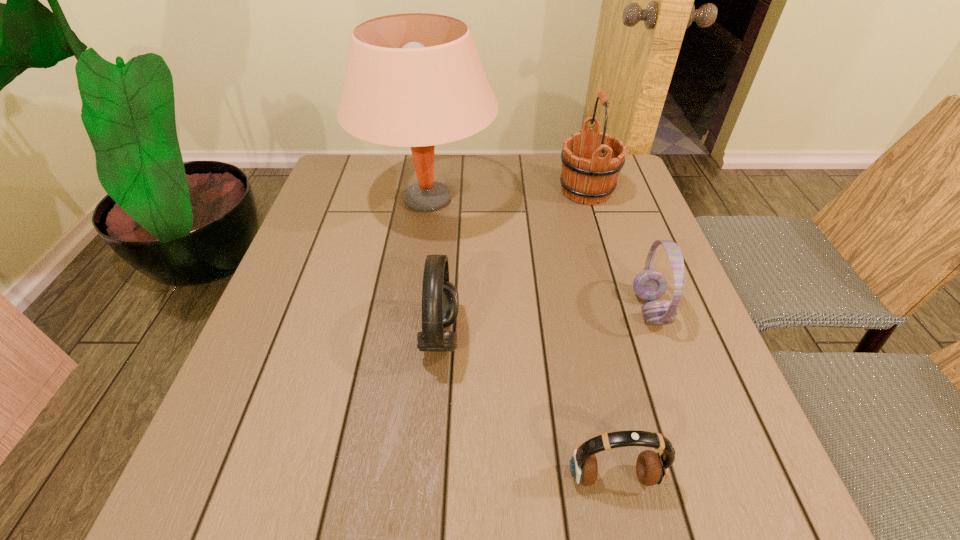
This screenshot has height=540, width=960. I want to click on free space located 0.260m on the headband and ear cups of the rightmost headset, so click(511, 309).

Identify the location of blank space located on the headband and ear cups of the rightmost headset. The width and height of the screenshot is (960, 540). (464, 309).

The height and width of the screenshot is (540, 960). What are the coordinates of `lampshade at the far edge` in the screenshot? It's located at (416, 80).

This screenshot has width=960, height=540. In order to click on wine bucket positioned at the far edge in this screenshot , I will do `click(589, 173)`.

This screenshot has width=960, height=540. Identify the location of object that is at the near edge. (652, 468).

Locate an element on the screen. This screenshot has width=960, height=540. object located in the left edge section of the desktop is located at coordinates (416, 80).

Where is `wine bucket positioned at the right edge`? This screenshot has width=960, height=540. wine bucket positioned at the right edge is located at coordinates pos(589,173).

The width and height of the screenshot is (960, 540). What are the coordinates of `headset that is positioned at the right edge` in the screenshot? It's located at (649, 285).

Image resolution: width=960 pixels, height=540 pixels. I want to click on object located at the far left corner, so click(416, 80).

This screenshot has height=540, width=960. In order to click on object that is at the far right corner in this screenshot , I will do `click(589, 173)`.